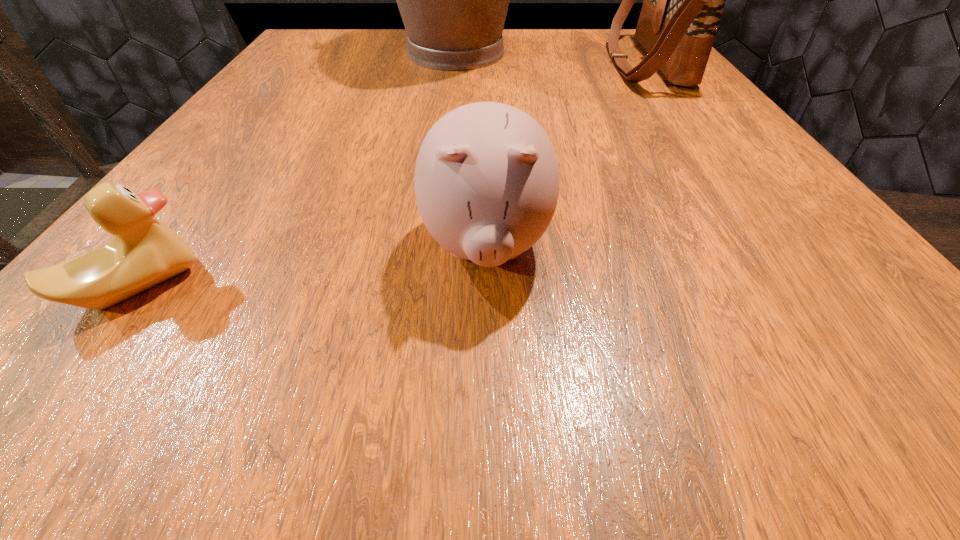
At what (x,y) coordinates should I click in order to perform the action: click on free space between the bucket and the shoulder bag. Please return your answer as a coordinate pair (x, y). Looking at the image, I should click on (551, 58).

Locate an element on the screen. This screenshot has width=960, height=540. vacant area between the rightmost object and the duck is located at coordinates (391, 174).

Locate an element on the screen. This screenshot has height=540, width=960. vacant point located between the rightmost object and the third tallest object is located at coordinates (x=565, y=154).

Locate an element on the screen. unoccupied position between the leftmost object and the bucket is located at coordinates (297, 170).

Point out which object is positioned as the third nearest to the piggy bank. Please provide its 2D coordinates. Your answer should be formatted as a tuple, i.e. [(x, y)], where the tuple contains the x and y coordinates of a point satisfying the conditions above.

[(453, 0)]

Identify which object is located as the third nearest to the piggy bank. Please provide its 2D coordinates. Your answer should be formatted as a tuple, i.e. [(x, y)], where the tuple contains the x and y coordinates of a point satisfying the conditions above.

[(453, 0)]

The height and width of the screenshot is (540, 960). In order to click on vacant position in the image that satisfies the following two spatial constraints: 1. at the snout of the third tallest object; 2. at the beak of the duck in this screenshot , I will do `click(487, 286)`.

Locate an element on the screen. The width and height of the screenshot is (960, 540). free spot that satisfies the following two spatial constraints: 1. on the front-facing side of the shoulder bag; 2. at the snout of the second shortest object is located at coordinates (779, 247).

Where is `free space that satisfies the following two spatial constraints: 1. on the front side of the tallest object; 2. at the beak of the duck`? free space that satisfies the following two spatial constraints: 1. on the front side of the tallest object; 2. at the beak of the duck is located at coordinates (431, 286).